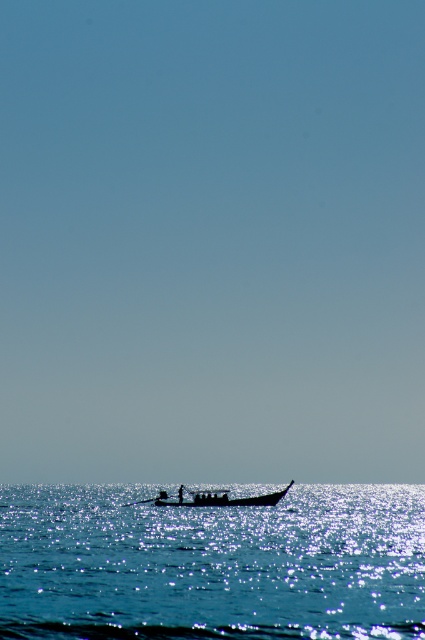
Which is in front, point (10, 524) or point (164, 493)?

Point (10, 524) is more forward.

Between glistening blue water at lower center and black wood paddle at center, which one is positioned lower?

Positioned lower is glistening blue water at lower center.

Measure the distance between point (388, 608) and camera.

Point (388, 608) is 126.59 feet away from camera.

This screenshot has height=640, width=425. What are the coordinates of `glistening blue water at lower center` in the screenshot? It's located at (212, 564).

Between glistening blue water at lower center and silhouette wooden boat at center, which one has less height?

silhouette wooden boat at center is shorter.

Between glistening blue water at lower center and silhouette wooden boat at center, which one appears on the left side from the viewer's perspective?

From the viewer's perspective, glistening blue water at lower center appears more on the left side.

Is point (167, 570) closer to viewer compared to point (266, 497)?

Yes, point (167, 570) is in front of point (266, 497).

The height and width of the screenshot is (640, 425). What are the coordinates of `glistening blue water at lower center` in the screenshot? It's located at (212, 564).

Does silhouette wooden boat at center come in front of black wood paddle at center?

Yes.

Between point (155, 500) and point (158, 497), which one is positioned in front?

Point (155, 500) is more forward.

Is point (178, 497) more distant than point (155, 499)?

No, it is not.

The height and width of the screenshot is (640, 425). Find the location of `silhouette wooden boat at center`. silhouette wooden boat at center is located at coordinates (221, 499).